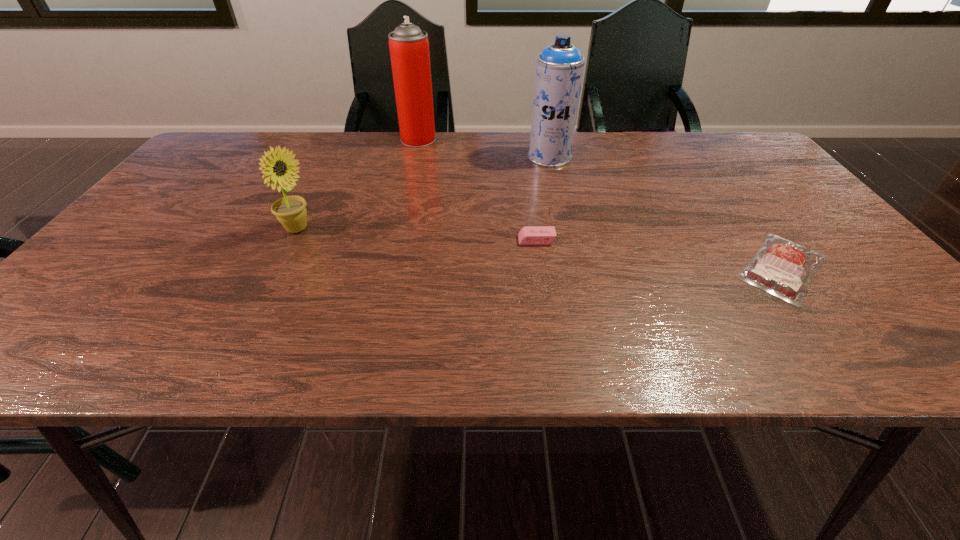
At what (x,y) coordinates should I click in order to perform the action: click on the second object from left to right. Please return your answer as a coordinate pair (x, y). The height and width of the screenshot is (540, 960). Looking at the image, I should click on (409, 47).

Find the location of a particular element. Image resolution: width=960 pixels, height=540 pixels. the right aerosol can is located at coordinates click(559, 68).

Where is `the leftmost object`? The height and width of the screenshot is (540, 960). the leftmost object is located at coordinates (291, 212).

The image size is (960, 540). What are the coordinates of `sunflower` in the screenshot? It's located at (291, 212).

Image resolution: width=960 pixels, height=540 pixels. In order to click on eraser in this screenshot , I will do `click(530, 235)`.

The height and width of the screenshot is (540, 960). Find the location of `steak`. steak is located at coordinates (783, 268).

I want to click on vacant area situated on the left of the left aerosol can, so click(302, 139).

Identify the location of free location located 0.070m on the left of the right aerosol can. (504, 157).

Image resolution: width=960 pixels, height=540 pixels. I want to click on free space located on the face of the third shortest object, so click(x=416, y=229).

Locate an element on the screen. vacant space situated on the left of the eraser is located at coordinates (422, 240).